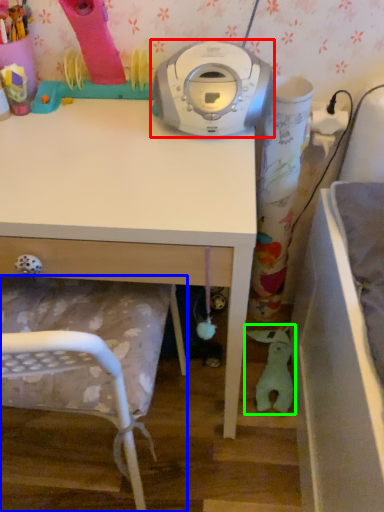
Question: Which object is positioned closest to home appliance (highlighted by a red box)? Select from chair (highlighted by a blue box) and toy (highlighted by a green box).

Choices:
 (A) chair
 (B) toy

Answer: (A)